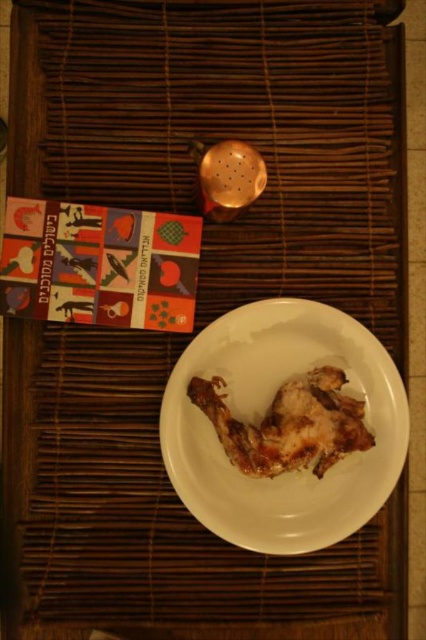
You are looking at the dining setup from above. There are two points marked on the bamboo mat. The first point is at coordinates point (253, 417) and the second point is at point (249, 440). Which point is closer to you?

Point (253, 417) is closer to you because it is further to the viewer than point (249, 440).

You are a chef preparing to place a new dish on the table. The white glossy plate at center is currently located at coordinates 0.653, 0.617. If you want to place a garnish exactly 0.1 units to the north of the plate, what would be the new coordinates for the garnish?

The new coordinates for the garnish would be (305, 417), as moving north increases the y coordinate by 0.1.

You are a guest at a dinner and see the white glossy plate at center and the golden crispy chicken at center. Which one is closer to the edge of the bamboo mat?

The golden crispy chicken at center is closer to the edge of the bamboo mat because the white glossy plate at center is below it, meaning the chicken is positioned higher up and nearer to the edge.